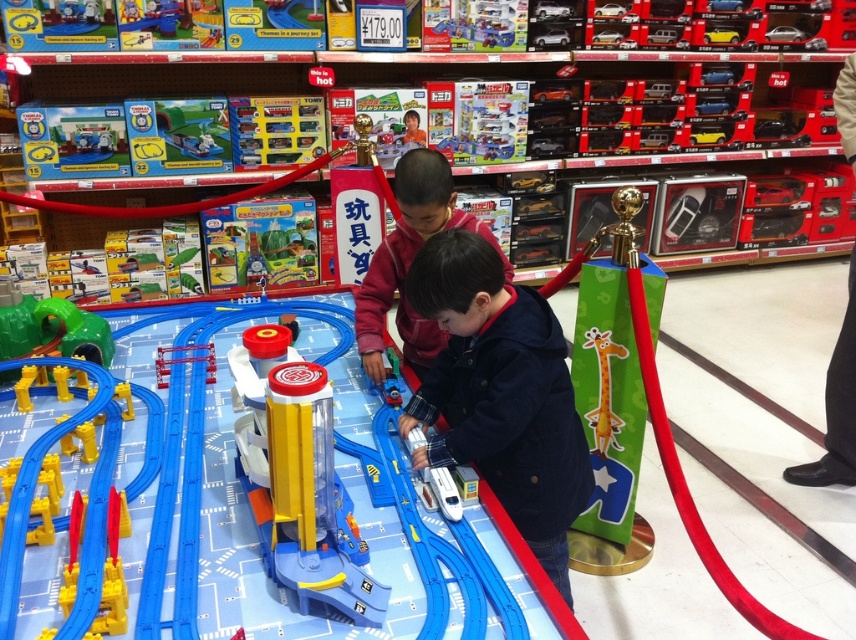
You are a parent trying to decide if the translucent plastic track at center can fit inside the red fleece jacket at center. Based on their sizes, can the track fit inside the jacket?

The translucent plastic track at center is narrower than the red fleece jacket at center, so it can fit inside the jacket.

You are a customer in the toy store looking at the Thomas the Tank Engine display. You see the translucent plastic track at center and the green plastic tunnel at lower left. Which object is positioned lower in the image?

The translucent plastic track at center is positioned below the green plastic tunnel at lower left, so it is lower in the image.

You are a parent trying to reach the green plastic tunnel at lower left while standing near the red fleece jacket at center. Can you comfortably reach it without moving your feet? Please state your answer and explain based on the distance between the two objects.

The red fleece jacket at center and green plastic tunnel at lower left are 33.75 inches apart. Since 33.75 inches is approximately 2.8 feet, which is within a comfortable reaching distance for most adults, you can likely reach the green plastic tunnel at lower left without moving your feet.